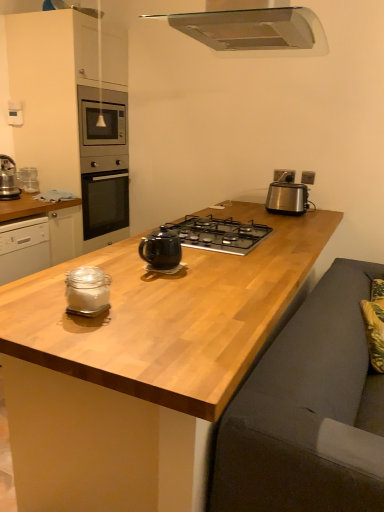
Locate an element on the screen. The image size is (384, 512). free space in front of satin silver toaster at right is located at coordinates (298, 216).